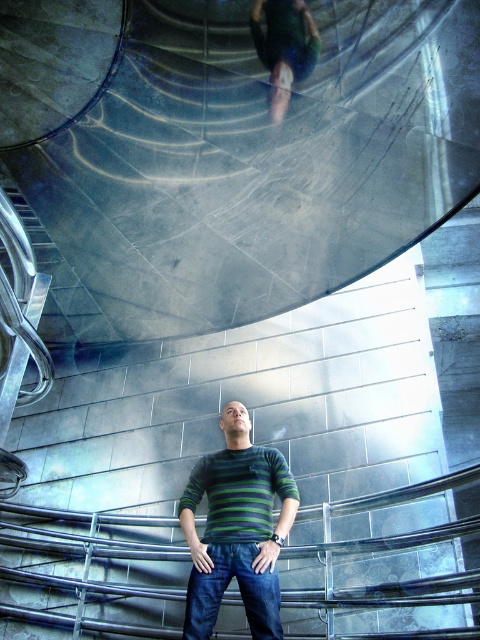
Who is positioned more to the left, green striped shirt at center or dark blue denim jeans at center?

From the viewer's perspective, green striped shirt at center appears more on the left side.

Which of these two, green striped shirt at center or dark blue denim jeans at center, stands shorter?

With less height is dark blue denim jeans at center.

Is point (263, 628) farther from camera compared to point (252, 547)?

No.

Image resolution: width=480 pixels, height=640 pixels. Find the location of `green striped shirt at center`. green striped shirt at center is located at coordinates (237, 529).

Does point (208, 488) lie in front of point (285, 64)?

That is True.

Measure the distance between green striped sweater at center and green fabric skateboard at upper center.

green striped sweater at center is 3.11 meters away from green fabric skateboard at upper center.

Which is in front, point (251, 451) or point (254, 35)?

Point (251, 451) is more forward.

I want to click on green striped sweater at center, so click(x=239, y=492).

Which is behind, point (189, 589) or point (285, 90)?

Positioned behind is point (285, 90).

Between green striped shirt at center and green fabric skateboard at upper center, which one has less height?

green fabric skateboard at upper center is shorter.

What do you see at coordinates (237, 529) in the screenshot? This screenshot has width=480, height=640. I see `green striped shirt at center` at bounding box center [237, 529].

Where is `green striped shirt at center`? The width and height of the screenshot is (480, 640). green striped shirt at center is located at coordinates (237, 529).